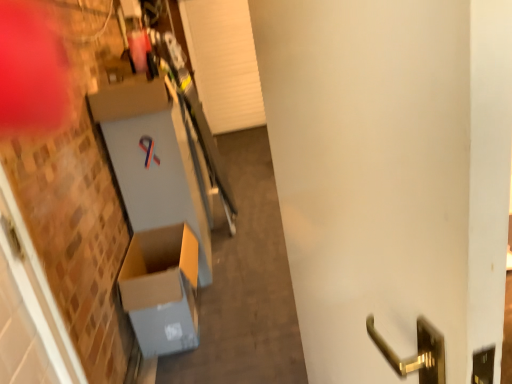
This screenshot has height=384, width=512. What are the coordinates of `white glossy door handle at center right` in the screenshot? It's located at (370, 174).

Measure the distance between white glossy door handle at center right and camera.

white glossy door handle at center right is 12.48 inches away from camera.

In order to face white glossy door handle at center right, should I rotate leftwards or rightwards?

You should look right and rotate roughly 11.700 degrees.

What do you see at coordinates (370, 174) in the screenshot? I see `white glossy door handle at center right` at bounding box center [370, 174].

In order to face brown cardboard box at lower left, should I rotate leftwards or rightwards?

Turn left approximately 11.210 degrees to face it.

This screenshot has height=384, width=512. What are the coordinates of `brown cardboard box at lower left` in the screenshot? It's located at (162, 289).

What is the approximate height of brown cardboard box at lower left?

It is 19.28 inches.

The height and width of the screenshot is (384, 512). What do you see at coordinates (162, 289) in the screenshot? I see `brown cardboard box at lower left` at bounding box center [162, 289].

You are a GUI agent. You are given a task and a screenshot of the screen. Output one action in this format:
    pyautogui.click(x=<x>, y=<y>)
    Task: Click on the white glossy door handle at center right
    Image resolution: width=512 pixels, height=384 pixels.
    Given the screenshot: What is the action you would take?
    pyautogui.click(x=370, y=174)

Looking at this image, which is more to the left, white glossy door handle at center right or brown cardboard box at lower left?

Positioned to the left is brown cardboard box at lower left.

Does white glossy door handle at center right lie behind brown cardboard box at lower left?

No.

Is point (455, 283) closer to viewer compared to point (181, 314)?

Yes.

From the image's perspective, between white glossy door handle at center right and brown cardboard box at lower left, who is located below?

brown cardboard box at lower left.

From a real-world perspective, is white glossy door handle at center right located higher than brown cardboard box at lower left?

Correct, in the physical world, white glossy door handle at center right is higher than brown cardboard box at lower left.

Considering the sizes of white glossy door handle at center right and brown cardboard box at lower left in the image, is white glossy door handle at center right wider or thinner than brown cardboard box at lower left?

In the image, white glossy door handle at center right appears to be more narrow than brown cardboard box at lower left.

Who is shorter, white glossy door handle at center right or brown cardboard box at lower left?

brown cardboard box at lower left is shorter.

Looking at the image, does white glossy door handle at center right seem bigger or smaller compared to brown cardboard box at lower left?

Considering their sizes, white glossy door handle at center right takes up more space than brown cardboard box at lower left.

Would you say white glossy door handle at center right is outside brown cardboard box at lower left?

Yes, white glossy door handle at center right is not within brown cardboard box at lower left.

Based on the photo, is white glossy door handle at center right far from brown cardboard box at lower left?

Absolutely, white glossy door handle at center right is distant from brown cardboard box at lower left.

Could you tell me if white glossy door handle at center right is turned towards brown cardboard box at lower left?

No, white glossy door handle at center right is not aimed at brown cardboard box at lower left.

Based on the photo, how many degrees apart are the facing directions of white glossy door handle at center right and brown cardboard box at lower left?

white glossy door handle at center right and brown cardboard box at lower left are facing 172 degrees away from each other.

At what (x,y) coordinates should I click in order to perform the action: click on cardboard box on the left of white glossy door handle at center right. Please return your answer as a coordinate pair (x, y). Image resolution: width=512 pixels, height=384 pixels. Looking at the image, I should click on (162, 289).

Which is more to the left, brown cardboard box at lower left or white glossy door handle at center right?

brown cardboard box at lower left is more to the left.

Does brown cardboard box at lower left lie behind white glossy door handle at center right?

Yes, it is behind white glossy door handle at center right.

Which is farther from the camera, (172, 282) or (458, 47)?

The point (172, 282) is farther from the camera.

From the image's perspective, is brown cardboard box at lower left over white glossy door handle at center right?

No.

From a real-world perspective, does brown cardboard box at lower left sit lower than white glossy door handle at center right?

Yes.

Does brown cardboard box at lower left have a greater width compared to white glossy door handle at center right?

Indeed, brown cardboard box at lower left has a greater width compared to white glossy door handle at center right.

Considering the sizes of brown cardboard box at lower left and white glossy door handle at center right in the image, is brown cardboard box at lower left taller or shorter than white glossy door handle at center right?

brown cardboard box at lower left is shorter than white glossy door handle at center right.

Who is bigger, brown cardboard box at lower left or white glossy door handle at center right?

With larger size is white glossy door handle at center right.

Is brown cardboard box at lower left not within white glossy door handle at center right?

Absolutely, brown cardboard box at lower left is external to white glossy door handle at center right.

Is brown cardboard box at lower left touching white glossy door handle at center right?

No.

Is brown cardboard box at lower left facing towards white glossy door handle at center right?

No, brown cardboard box at lower left is not turned towards white glossy door handle at center right.

What's the angular difference between brown cardboard box at lower left and white glossy door handle at center right's facing directions?

The angular difference between brown cardboard box at lower left and white glossy door handle at center right is 172 degrees.

This screenshot has height=384, width=512. What are the coordinates of `door above the brown cardboard box at lower left (from a real-world perspective)` in the screenshot? It's located at (370, 174).

At what (x,y) coordinates should I click in order to perform the action: click on cardboard box below the white glossy door handle at center right (from the image's perspective). Please return your answer as a coordinate pair (x, y). Looking at the image, I should click on (162, 289).

The image size is (512, 384). I want to click on cardboard box located underneath the white glossy door handle at center right (from a real-world perspective), so click(162, 289).